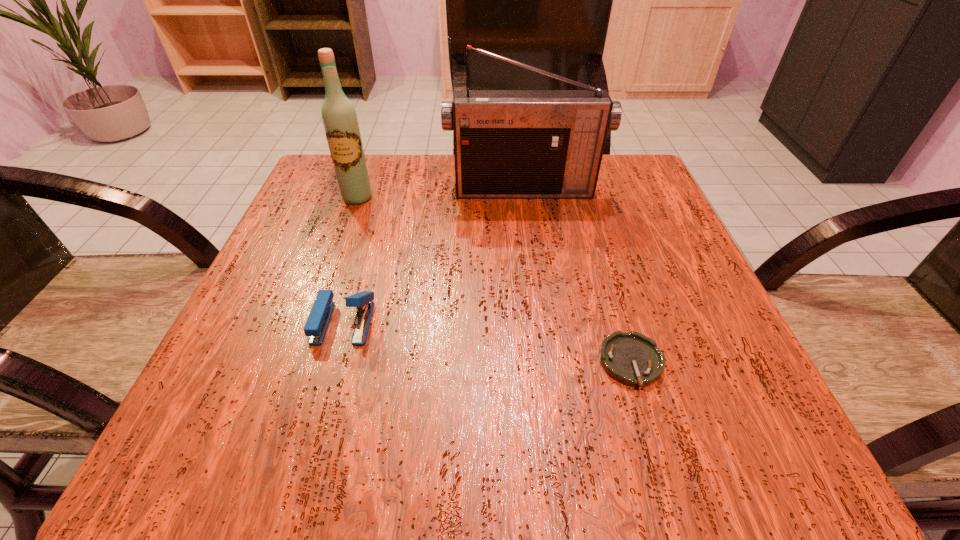
Locate an element on the screen. The height and width of the screenshot is (540, 960). wine bottle is located at coordinates click(x=340, y=121).

In order to click on radio receiver in this screenshot , I will do (508, 144).

Find the location of a particular element. The image size is (960, 540). stapler is located at coordinates (316, 325).

Where is `ashtray`? This screenshot has height=540, width=960. ashtray is located at coordinates (633, 359).

Identify the location of vacant area located 0.220m on the front-facing side of the wine bottle. (x=328, y=279).

In order to click on vacant area located 0.310m on the front-facing side of the radio receiver in this screenshot , I will do `click(539, 308)`.

Where is `vacant space situated 0.340m on the back of the third tallest object`? The width and height of the screenshot is (960, 540). vacant space situated 0.340m on the back of the third tallest object is located at coordinates (382, 188).

Find the location of `vacant space situated 0.280m on the back of the shortest object`. vacant space situated 0.280m on the back of the shortest object is located at coordinates (590, 226).

You are a GUI agent. You are given a task and a screenshot of the screen. Output one action in this format:
    pyautogui.click(x=<x>, y=<y>)
    Task: Click on the wine bottle at the far edge
    
    Given the screenshot: What is the action you would take?
    pyautogui.click(x=340, y=121)

The width and height of the screenshot is (960, 540). I want to click on radio receiver at the far edge, so click(x=508, y=144).